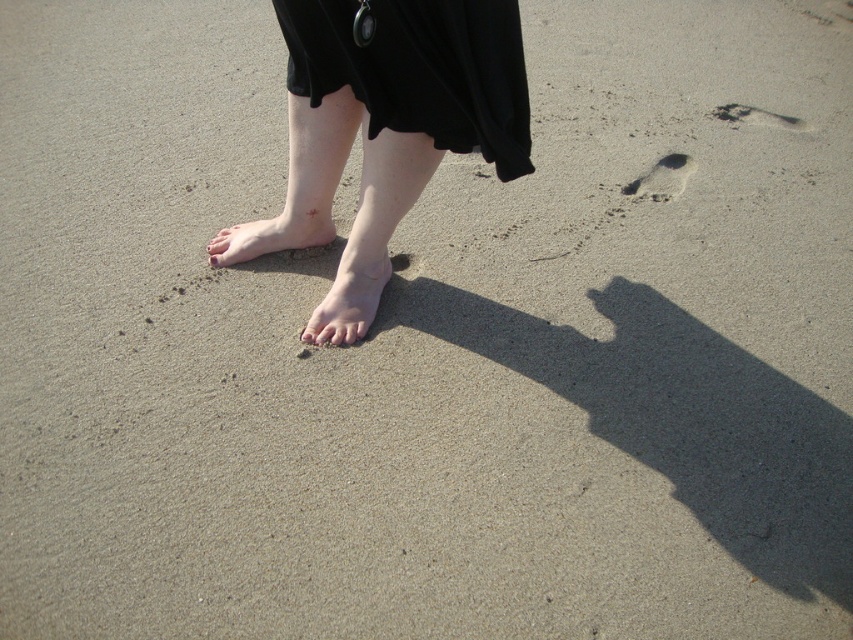
Question: From the image, what is the correct spatial relationship of smooth skin bare feet at center in relation to matte pink nail at center?

Choices:
 (A) left
 (B) right

Answer: (B)

Question: Which point is closer to the camera taking this photo?

Choices:
 (A) (728, 122)
 (B) (422, 90)

Answer: (B)

Question: Where is smooth skin foot at center located in relation to pale skin at center in the image?

Choices:
 (A) right
 (B) left

Answer: (A)

Question: Does matte pink nail at center have a smaller size compared to pink flesh at center?

Choices:
 (A) yes
 (B) no

Answer: (B)

Question: Which of these objects is positioned closest to the pale skin at center?

Choices:
 (A) matte pink nail at center
 (B) black matte skirt at center
 (C) pink flesh at center

Answer: (C)

Question: Estimate the real-world distances between objects in this image. Which object is closer to the matte pink nail at center?

Choices:
 (A) smooth skin bare feet at center
 (B) brown sandy footprint at upper right
 (C) brown sandy footprint at lower right

Answer: (A)